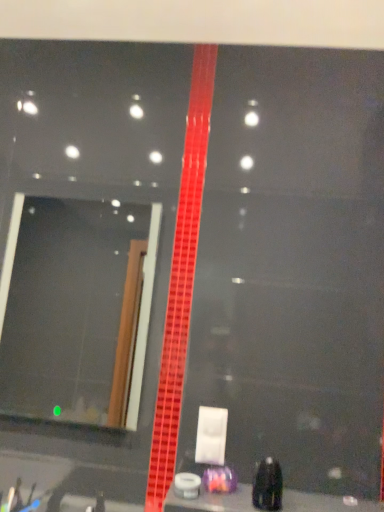
The width and height of the screenshot is (384, 512). Describe the element at coordinates (268, 485) in the screenshot. I see `black plastic bottle at lower right, which is the second toiletry from left to right` at that location.

You are a GUI agent. You are given a task and a screenshot of the screen. Output one action in this format:
    pyautogui.click(x=<x>, y=<y>)
    Task: Click on the translucent purple container at center, which is counted as the second toiletry, starting from the front
    The width and height of the screenshot is (384, 512).
    Given the screenshot: What is the action you would take?
    pyautogui.click(x=219, y=479)

What do you see at coordinates (76, 309) in the screenshot? This screenshot has height=512, width=384. I see `matte glass mirror at left` at bounding box center [76, 309].

Image resolution: width=384 pixels, height=512 pixels. Find the location of `black plastic bottle at lower right, which appears as the second toiletry when viewed from the back`. black plastic bottle at lower right, which appears as the second toiletry when viewed from the back is located at coordinates (268, 485).

How different are the orientations of translucent purple container at center, which is the 1th toiletry from back to front, and black plastic bottle at lower right, positioned as the 1th toiletry in front-to-back order, in degrees?

They differ by 2.21 degrees in their facing directions.

From the picture: Could you measure the distance between translucent purple container at center, acting as the 2th toiletry starting from the right, and black plastic bottle at lower right, which is the second toiletry from left to right?

They are 3.87 inches apart.

Considering the sizes of translucent purple container at center, which is counted as the second toiletry, starting from the front, and black plastic bottle at lower right, which is the second toiletry from left to right, in the image, is translucent purple container at center, which is counted as the second toiletry, starting from the front, wider or thinner than black plastic bottle at lower right, which is the second toiletry from left to right,?

In the image, translucent purple container at center, which is counted as the second toiletry, starting from the front, appears to be wider than black plastic bottle at lower right, which is the second toiletry from left to right.

Does translucent purple container at center, which is the 1th toiletry from back to front, have a greater height compared to black plastic bottle at lower right, which appears as the second toiletry when viewed from the back?

No, translucent purple container at center, which is the 1th toiletry from back to front, is not taller than black plastic bottle at lower right, which appears as the second toiletry when viewed from the back.

Who is bigger, matte glass mirror at left or translucent purple container at center, which is the 1th toiletry from back to front?

matte glass mirror at left.

From a real-world perspective, between matte glass mirror at left and translucent purple container at center, which is the first toiletry from left to right, who is vertically lower?

translucent purple container at center, which is the first toiletry from left to right.

Is matte glass mirror at left shorter than translucent purple container at center, acting as the 2th toiletry starting from the right?

No.

Is black plastic bottle at lower right, which is the second toiletry from left to right, smaller than smooth black surface at bottom?

Yes.

Can we say black plastic bottle at lower right, which is the second toiletry from left to right, lies outside smooth black surface at bottom?

Yes, black plastic bottle at lower right, which is the second toiletry from left to right, is located beyond the bounds of smooth black surface at bottom.

From a real-world perspective, does black plastic bottle at lower right, which is the first toiletry in right-to-left order, sit lower than smooth black surface at bottom?

No, from a real-world perspective, black plastic bottle at lower right, which is the first toiletry in right-to-left order, is not under smooth black surface at bottom.

Based on the photo, from the image's perspective, is smooth black surface at bottom above matte glass mirror at left?

No.

Is point (293, 511) behind point (21, 256)?

No, it is not.

Considering the relative positions of smooth black surface at bottom and matte glass mirror at left in the image provided, is smooth black surface at bottom to the right of matte glass mirror at left from the viewer's perspective?

Indeed, smooth black surface at bottom is positioned on the right side of matte glass mirror at left.

Would you say translucent purple container at center, which is counted as the second toiletry, starting from the front, is inside or outside smooth black surface at bottom?

translucent purple container at center, which is counted as the second toiletry, starting from the front, exists outside the volume of smooth black surface at bottom.

Considering the relative sizes of translucent purple container at center, which is counted as the second toiletry, starting from the front, and smooth black surface at bottom in the image provided, is translucent purple container at center, which is counted as the second toiletry, starting from the front, smaller than smooth black surface at bottom?

Indeed, translucent purple container at center, which is counted as the second toiletry, starting from the front, has a smaller size compared to smooth black surface at bottom.

Looking at their sizes, would you say translucent purple container at center, acting as the 2th toiletry starting from the right, is wider or thinner than smooth black surface at bottom?

In the image, translucent purple container at center, acting as the 2th toiletry starting from the right, appears to be more narrow than smooth black surface at bottom.

From the image's perspective, which is above, translucent purple container at center, which is the 1th toiletry from back to front, or smooth black surface at bottom?

translucent purple container at center, which is the 1th toiletry from back to front.

Measure the distance from smooth black surface at bottom to translucent purple container at center, which is the 1th toiletry from back to front.

A distance of 10.98 centimeters exists between smooth black surface at bottom and translucent purple container at center, which is the 1th toiletry from back to front.

I want to click on counter top below the translucent purple container at center, which is the first toiletry from left to right (from the image's perspective), so (212, 501).

Is smooth black surface at bottom taller than translucent purple container at center, which is the 1th toiletry from back to front?

In fact, smooth black surface at bottom may be shorter than translucent purple container at center, which is the 1th toiletry from back to front.

From a real-world perspective, is smooth black surface at bottom beneath translucent purple container at center, which is counted as the second toiletry, starting from the front?

Indeed, from a real-world perspective, smooth black surface at bottom is positioned beneath translucent purple container at center, which is counted as the second toiletry, starting from the front.

From the image's perspective, which one is positioned lower, matte glass mirror at left or smooth black surface at bottom?

smooth black surface at bottom.

Is matte glass mirror at left touching smooth black surface at bottom?

No, matte glass mirror at left is not beside smooth black surface at bottom.

From a real-world perspective, which is physically above, matte glass mirror at left or smooth black surface at bottom?

From a 3D spatial view, matte glass mirror at left is above.

You are a GUI agent. You are given a task and a screenshot of the screen. Output one action in this format:
    pyautogui.click(x=<x>, y=<y>)
    Task: Click on the toiletry located in front of the translucent purple container at center, which is counted as the second toiletry, starting from the front
    The image size is (384, 512).
    Given the screenshot: What is the action you would take?
    pyautogui.click(x=268, y=485)

The image size is (384, 512). I want to click on the 1st toiletry to the right when counting from the matte glass mirror at left, so click(x=219, y=479).

From the image, which object appears to be farther from translucent purple container at center, acting as the 2th toiletry starting from the right, matte glass mirror at left or black plastic bottle at lower right, which is the second toiletry from left to right?

matte glass mirror at left.

Consider the image. Based on their spatial positions, is black plastic bottle at lower right, which appears as the second toiletry when viewed from the back, or smooth black surface at bottom closer to matte glass mirror at left?

smooth black surface at bottom lies closer to matte glass mirror at left than the other object.

Based on the photo, looking at the image, which one is located further to smooth black surface at bottom, translucent purple container at center, which is counted as the second toiletry, starting from the front, or black plastic bottle at lower right, which appears as the second toiletry when viewed from the back?

translucent purple container at center, which is counted as the second toiletry, starting from the front.

Which object lies further to the anchor point translucent purple container at center, which is counted as the second toiletry, starting from the front, smooth black surface at bottom or matte glass mirror at left?

matte glass mirror at left lies further to translucent purple container at center, which is counted as the second toiletry, starting from the front, than the other object.

Considering their positions, is black plastic bottle at lower right, positioned as the 1th toiletry in front-to-back order, positioned closer to matte glass mirror at left than translucent purple container at center, which is the 1th toiletry from back to front?

The object closer to matte glass mirror at left is translucent purple container at center, which is the 1th toiletry from back to front.

Estimate the real-world distances between objects in this image. Which object is closer to translucent purple container at center, which is the first toiletry from left to right, black plastic bottle at lower right, which is the second toiletry from left to right, or smooth black surface at bottom?

The object closer to translucent purple container at center, which is the first toiletry from left to right, is black plastic bottle at lower right, which is the second toiletry from left to right.

Estimate the real-world distances between objects in this image. Which object is closer to smooth black surface at bottom, black plastic bottle at lower right, positioned as the 1th toiletry in front-to-back order, or matte glass mirror at left?

black plastic bottle at lower right, positioned as the 1th toiletry in front-to-back order, is positioned closer to the anchor smooth black surface at bottom.

Looking at the image, which one is located closer to matte glass mirror at left, translucent purple container at center, which is counted as the second toiletry, starting from the front, or smooth black surface at bottom?

Based on the image, translucent purple container at center, which is counted as the second toiletry, starting from the front, appears to be nearer to matte glass mirror at left.

Identify the location of toiletry between matte glass mirror at left and black plastic bottle at lower right, which is the second toiletry from left to right. [219, 479].

This screenshot has width=384, height=512. In order to click on toiletry located between smooth black surface at bottom and translucent purple container at center, acting as the 2th toiletry starting from the right, in the depth direction in this screenshot , I will do click(268, 485).